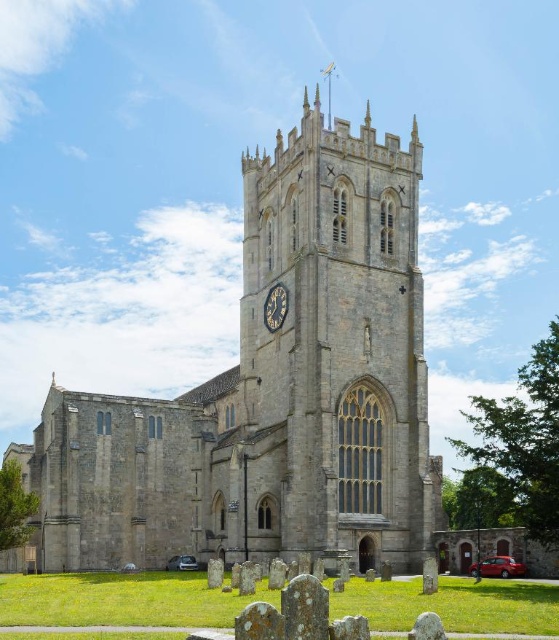
You are a tourist standing in front of the gray stone church at center and the dark blue stone clock at center. Which structure do you see towering higher above you?

The gray stone church at center is taller than the dark blue stone clock at center, so you see the gray stone church at center towering higher above you.

You are standing at point A located at coordinates (271, 392). Looking around, what is the most prominent structure you see?

The most prominent structure at point A located at coordinates (271, 392) is the gray stone church at center.

Consider the image. You are a photographer planning to capture the gray stone church at center and the dark blue stone clock at center in a single frame. Based on their widths, can you determine which object will appear larger in the photo?

The gray stone church at center might be wider than dark blue stone clock at center, so it could appear larger in the photo depending on their actual widths.